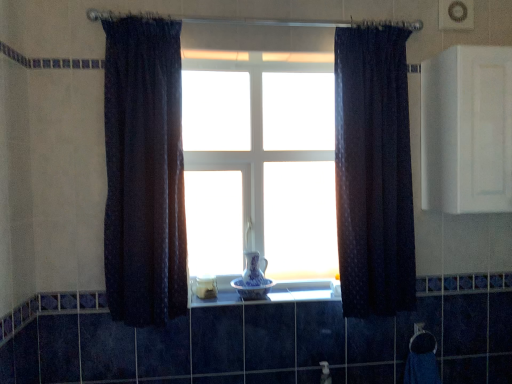
Question: Is blue porcelain vase at center, the 2th glass vase positioned from the top, not inside white matte cabinet at upper right?

Choices:
 (A) yes
 (B) no

Answer: (A)

Question: Would you say white matte cabinet at upper right is part of blue porcelain vase at center, the 2th glass vase positioned from the top,'s contents?

Choices:
 (A) no
 (B) yes

Answer: (A)

Question: Considering the relative sizes of blue porcelain vase at center, the 2th glass vase positioned from the top, and white matte cabinet at upper right in the image provided, is blue porcelain vase at center, the 2th glass vase positioned from the top, smaller than white matte cabinet at upper right?

Choices:
 (A) no
 (B) yes

Answer: (B)

Question: Does blue porcelain vase at center, the 2th glass vase positioned from the top, lie in front of white matte cabinet at upper right?

Choices:
 (A) yes
 (B) no

Answer: (B)

Question: Can you confirm if blue porcelain vase at center, the 2th glass vase positioned from the top, is taller than white matte cabinet at upper right?

Choices:
 (A) yes
 (B) no

Answer: (B)

Question: Based on their positions, is dark textured curtain at left, placed as the 1th curtain when sorted from left to right, located to the left or right of white glass vase at center?

Choices:
 (A) right
 (B) left

Answer: (B)

Question: Is dark textured curtain at left, acting as the 2th curtain starting from the right, bigger or smaller than white glass vase at center?

Choices:
 (A) big
 (B) small

Answer: (A)

Question: Looking at their shapes, would you say dark textured curtain at left, placed as the 1th curtain when sorted from left to right, is wider or thinner than white glass vase at center?

Choices:
 (A) wide
 (B) thin

Answer: (A)

Question: Does point (128, 96) appear closer or farther from the camera than point (269, 109)?

Choices:
 (A) closer
 (B) farther

Answer: (A)

Question: Is dark blue textured curtain at center, which is the 1th curtain from right to left, bigger or smaller than white matte cabinet at upper right?

Choices:
 (A) big
 (B) small

Answer: (B)

Question: Considering the positions of point (410, 243) and point (501, 100), is point (410, 243) closer or farther from the camera than point (501, 100)?

Choices:
 (A) farther
 (B) closer

Answer: (A)

Question: Is dark blue textured curtain at center, which is the 1th curtain from right to left, situated inside white matte cabinet at upper right or outside?

Choices:
 (A) inside
 (B) outside

Answer: (B)

Question: From a real-world perspective, is dark blue textured curtain at center, which is the 1th curtain from right to left, above or below white matte cabinet at upper right?

Choices:
 (A) above
 (B) below

Answer: (B)

Question: From the image's perspective, is blue porcelain vase at center, the first glass vase in the top-to-bottom sequence, located above or below white matte cabinet at upper right?

Choices:
 (A) above
 (B) below

Answer: (B)

Question: Relative to white matte cabinet at upper right, is blue porcelain vase at center, marked as the 2th glass vase in a bottom-to-top arrangement, in front or behind?

Choices:
 (A) front
 (B) behind

Answer: (B)